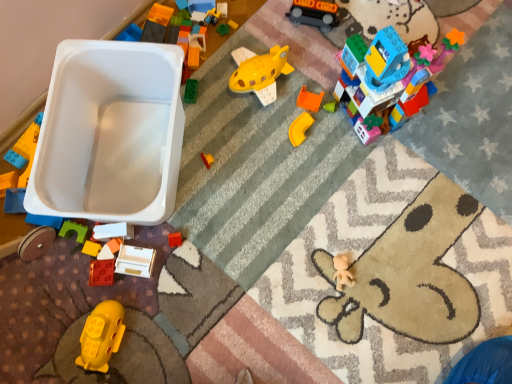
Find the location of a particular element. The image size is (512, 384). free space between yellow matte plastic corner piece at center-right, acting as the third toy starting from the right, and multicolored plastic building block at upper right, the 2th toy from the top is located at coordinates 325,129.